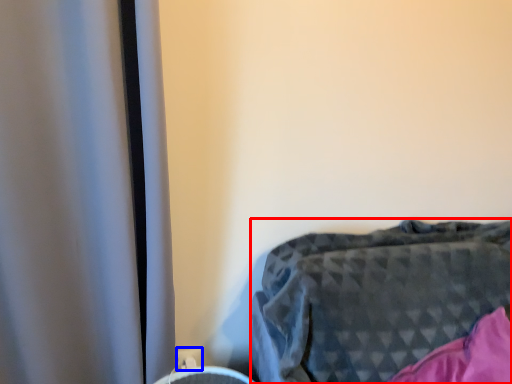
Question: Which of the following is the closest to the observer, furniture (highlighted by a red box) or electric outlet (highlighted by a blue box)?

Choices:
 (A) furniture
 (B) electric outlet

Answer: (A)